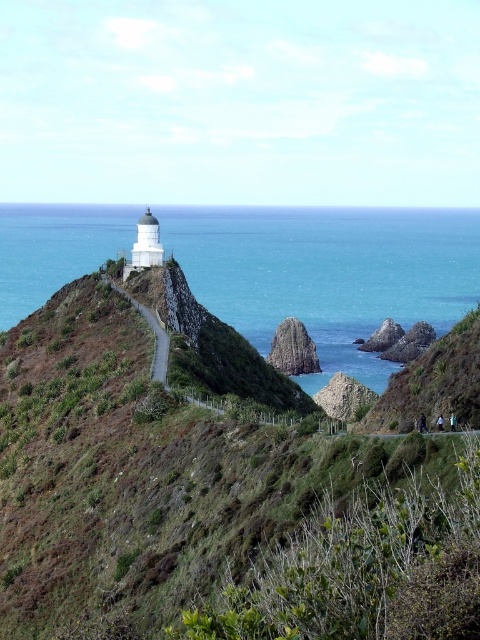
Question: Considering the relative positions of green grassy hillside at upper left and blue water at upper center in the image provided, where is green grassy hillside at upper left located with respect to blue water at upper center?

Choices:
 (A) above
 (B) below

Answer: (B)

Question: Which point appears farthest from the camera in this image?

Choices:
 (A) (350, 320)
 (B) (22, 484)

Answer: (A)

Question: In this image, where is green grassy hillside at upper left located relative to blue water at upper center?

Choices:
 (A) right
 (B) left

Answer: (B)

Question: From the image, what is the correct spatial relationship of green grassy hillside at upper left in relation to blue water at upper center?

Choices:
 (A) above
 (B) below

Answer: (B)

Question: Which of the following is the farthest from the observer?

Choices:
 (A) green grassy hillside at upper left
 (B) blue water at upper center

Answer: (B)